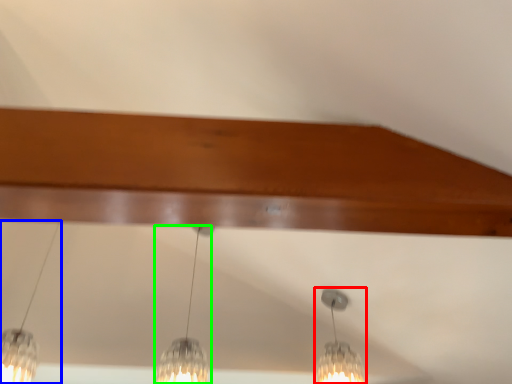
Question: Which object is positioned closest to lamp (highlighted by a red box)? Select from lamp (highlighted by a blue box) and lamp (highlighted by a green box).

Choices:
 (A) lamp
 (B) lamp

Answer: (B)